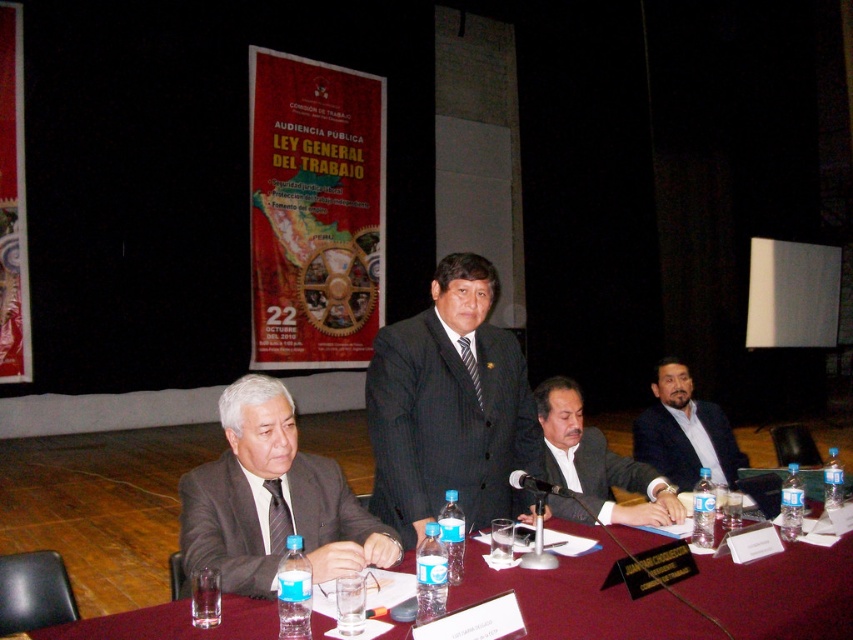
Between point (422, 356) and point (663, 465), which one is positioned behind?

Point (663, 465)

This screenshot has width=853, height=640. In order to click on dark gray pinstripe suit at center in this screenshot , I will do `click(450, 404)`.

Measure the distance from matte gray suit at center to red fabric banner at upper left.

matte gray suit at center is 7.11 meters from red fabric banner at upper left.

Does matte gray suit at center have a lesser width compared to red fabric banner at upper left?

No.

The height and width of the screenshot is (640, 853). What are the coordinates of `matte gray suit at center` in the screenshot? It's located at (271, 500).

Is red paper poster at upper center to the left of translucent plastic water at table center from the viewer's perspective?

Indeed, red paper poster at upper center is positioned on the left side of translucent plastic water at table center.

Can you confirm if red paper poster at upper center is shorter than translucent plastic water at table center?

Incorrect, red paper poster at upper center's height does not fall short of translucent plastic water at table center's.

Who is more forward, (271,131) or (569,560)?

Positioned in front is point (569,560).

Where is `red paper poster at upper center`? The height and width of the screenshot is (640, 853). red paper poster at upper center is located at coordinates (314, 212).